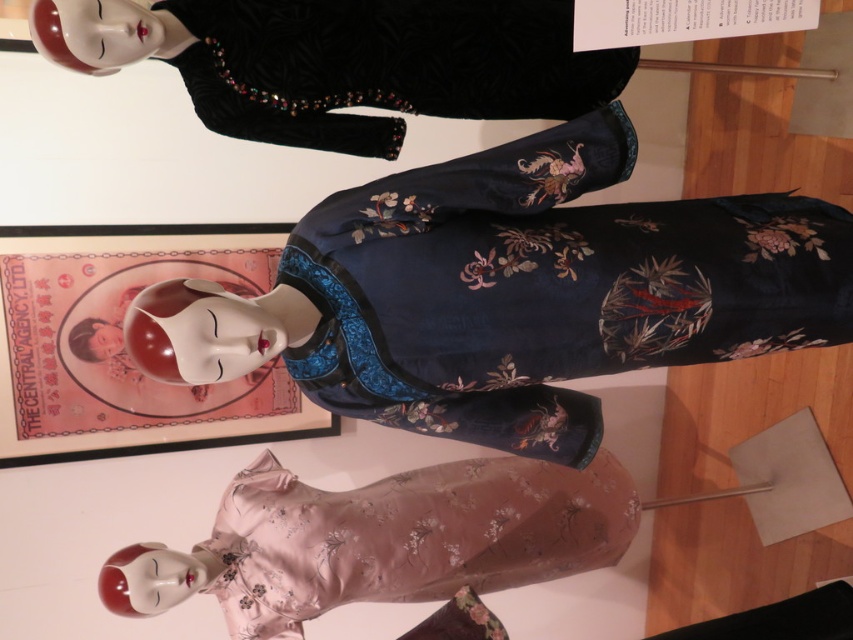
Between point (485, 269) and point (318, 138), which one is positioned in front?

Point (485, 269) is in front.

Describe the element at coordinates (515, 292) in the screenshot. I see `navy satin dress at center` at that location.

Image resolution: width=853 pixels, height=640 pixels. Find the location of `navy satin dress at center`. navy satin dress at center is located at coordinates (515, 292).

In the scene shown: Which of these two, velvet black dress at upper center or pale pink satin dress at lower center, stands shorter?

velvet black dress at upper center is shorter.

The image size is (853, 640). Identify the location of velvet black dress at upper center. (343, 61).

Is navy satin dress at center smaller than pale pink satin dress at lower center?

Incorrect, navy satin dress at center is not smaller in size than pale pink satin dress at lower center.

Which is in front, point (582, 212) or point (505, 573)?

Point (582, 212)

This screenshot has width=853, height=640. In order to click on navy satin dress at center in this screenshot , I will do `click(515, 292)`.